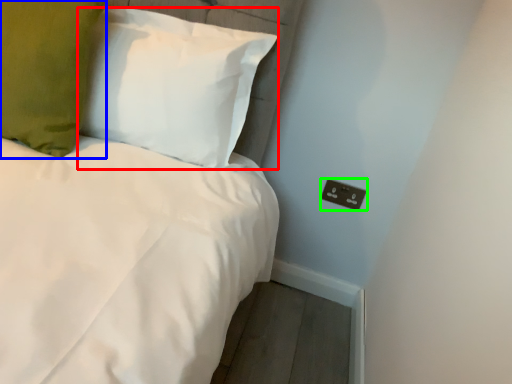
Question: Which object is positioned closest to pillow (highlighted by a red box)? Select from pillow (highlighted by a blue box) and electric outlet (highlighted by a green box).

Choices:
 (A) pillow
 (B) electric outlet

Answer: (A)